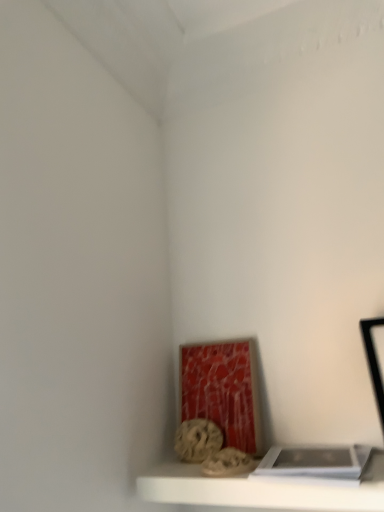
Question: Based on their positions, is rustic stone sculpture at lower center located to the left or right of white matte book at lower right?

Choices:
 (A) right
 (B) left

Answer: (B)

Question: Considering their positions, is rustic stone sculpture at lower center located in front of or behind white matte book at lower right?

Choices:
 (A) behind
 (B) front

Answer: (A)

Question: Which of these objects is positioned closest to the rustic stone sculpture at lower center?

Choices:
 (A) white matte shelf at lower center
 (B) white matte book at lower right

Answer: (A)

Question: Which is nearer to the white matte shelf at lower center?

Choices:
 (A) rustic stone sculpture at lower center
 (B) white matte book at lower right

Answer: (B)